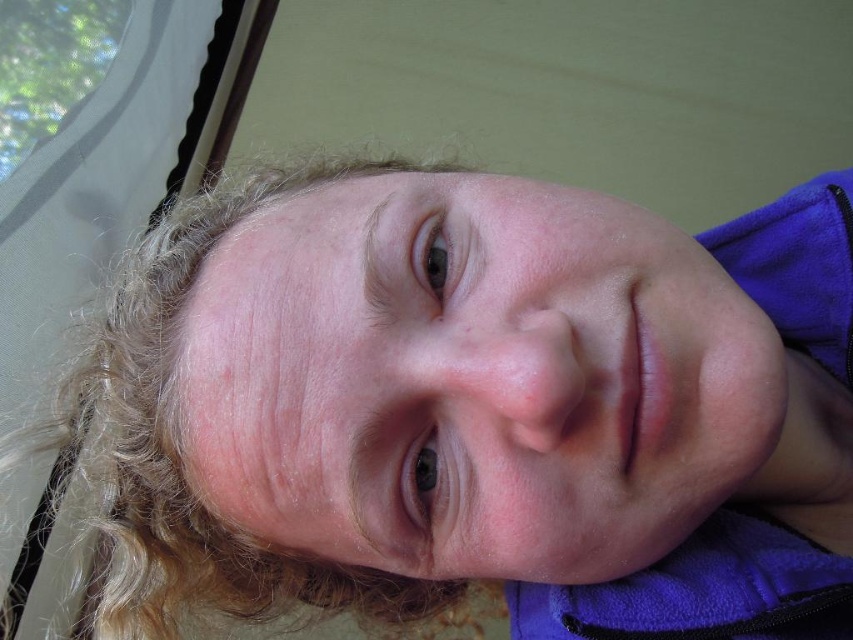
Is smooth skin face at center wider than blonde curly hair at upper left?

In fact, smooth skin face at center might be narrower than blonde curly hair at upper left.

Consider the image. Can you confirm if smooth skin face at center is positioned above blonde curly hair at upper left?

Correct, smooth skin face at center is located above blonde curly hair at upper left.

Identify the location of smooth skin face at center. The image size is (853, 640). (471, 380).